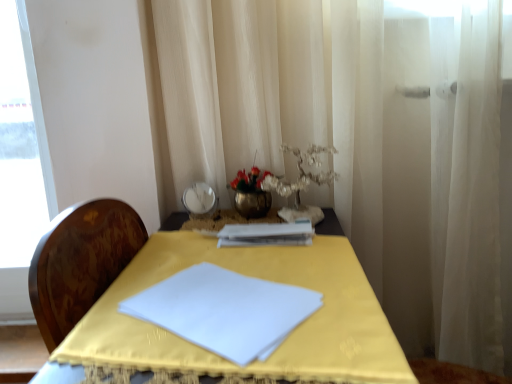
Question: Is white paper journal at center shorter than white sheer curtain at right?

Choices:
 (A) yes
 (B) no

Answer: (A)

Question: Is white paper journal at center further to the viewer compared to white sheer curtain at right?

Choices:
 (A) no
 (B) yes

Answer: (B)

Question: Is white sheer curtain at right a part of white paper journal at center?

Choices:
 (A) yes
 (B) no

Answer: (B)

Question: Is white paper journal at center bigger than white sheer curtain at right?

Choices:
 (A) no
 (B) yes

Answer: (A)

Question: From the image's perspective, is white paper journal at center beneath white sheer curtain at right?

Choices:
 (A) yes
 (B) no

Answer: (B)

Question: Is metallic vase at center bigger or smaller than matte silver bowl at upper center?

Choices:
 (A) small
 (B) big

Answer: (B)

Question: Is metallic vase at center spatially inside matte silver bowl at upper center, or outside of it?

Choices:
 (A) inside
 (B) outside

Answer: (B)

Question: In terms of width, does metallic vase at center look wider or thinner when compared to matte silver bowl at upper center?

Choices:
 (A) wide
 (B) thin

Answer: (A)

Question: Considering the relative positions of metallic vase at center and matte silver bowl at upper center in the image provided, is metallic vase at center to the left or to the right of matte silver bowl at upper center?

Choices:
 (A) left
 (B) right

Answer: (B)

Question: In terms of height, does matte silver bowl at upper center look taller or shorter compared to white paper journal at center?

Choices:
 (A) tall
 (B) short

Answer: (A)

Question: Is matte silver bowl at upper center wider or thinner than white paper journal at center?

Choices:
 (A) thin
 (B) wide

Answer: (A)

Question: Based on their sizes in the image, would you say matte silver bowl at upper center is bigger or smaller than white paper journal at center?

Choices:
 (A) small
 (B) big

Answer: (A)

Question: Is matte silver bowl at upper center to the left or to the right of white paper journal at center in the image?

Choices:
 (A) right
 (B) left

Answer: (B)

Question: Is white sheer curtain at right wider or thinner than matte silver bowl at upper center?

Choices:
 (A) thin
 (B) wide

Answer: (B)

Question: Is white sheer curtain at right bigger or smaller than matte silver bowl at upper center?

Choices:
 (A) big
 (B) small

Answer: (A)